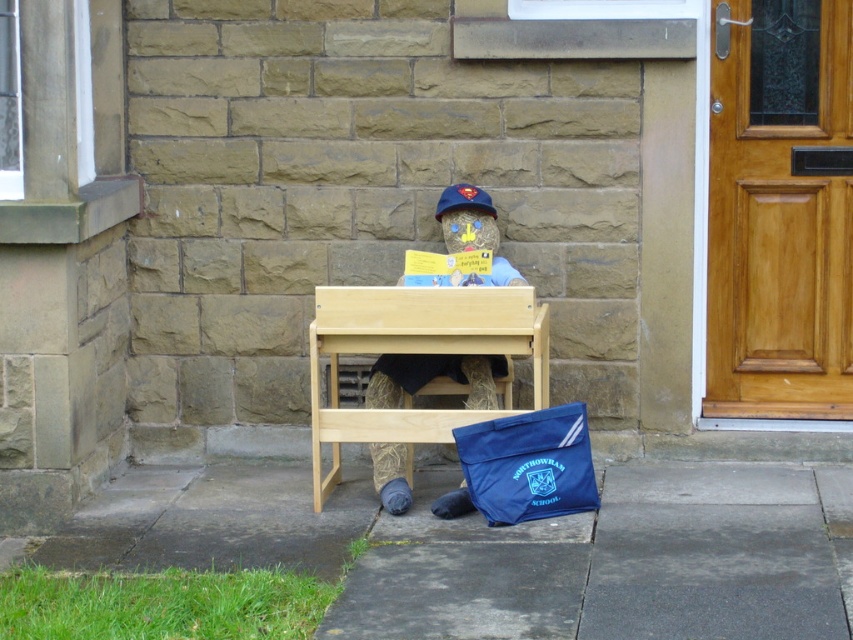
You are a student who needs to place your blue fabric bag at lower center on the natural wood table at center. Can you do that based on their positions?

The natural wood table at center is located above the blue fabric bag at lower center, so the bag is already positioned under the table. Since the table is above the bag, placing the bag on the table would require moving it upwards, which is possible if there is enough space between them.